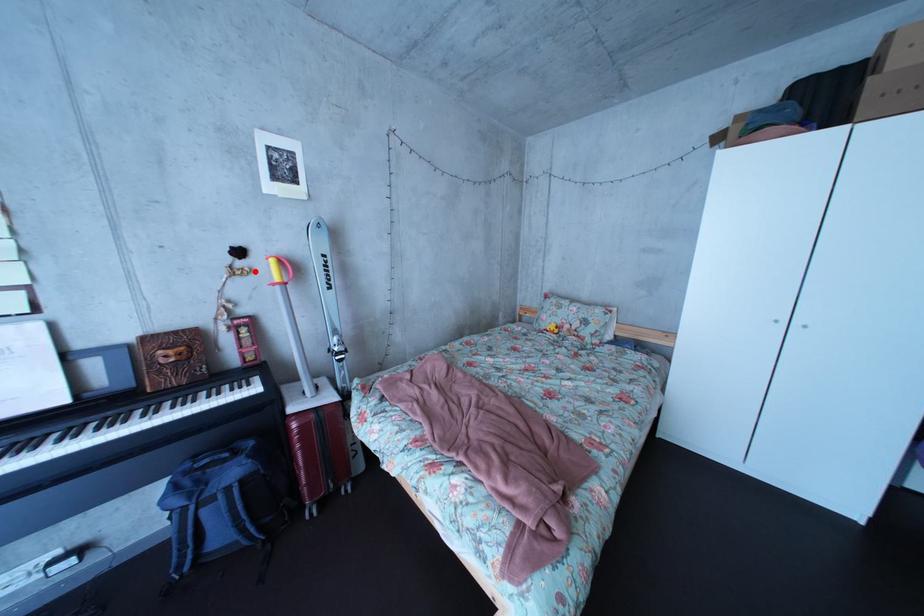
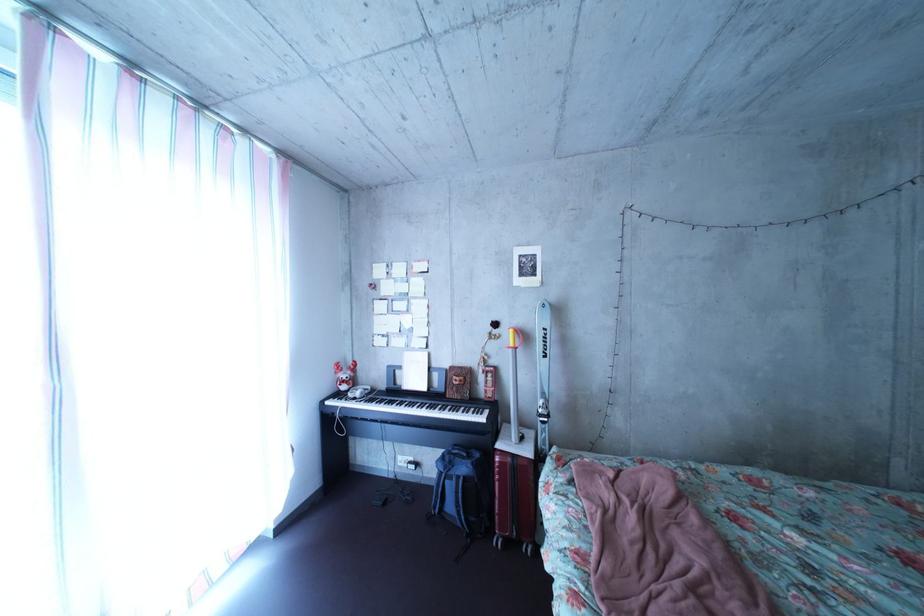
Locate, in the second image, the point that corresponds to the highlighted location in the first image.

(509, 339)